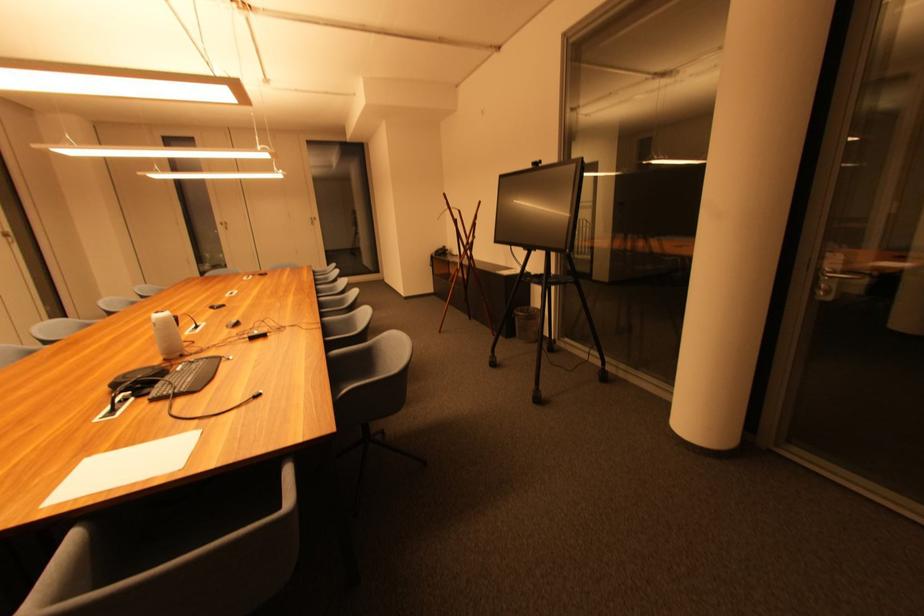
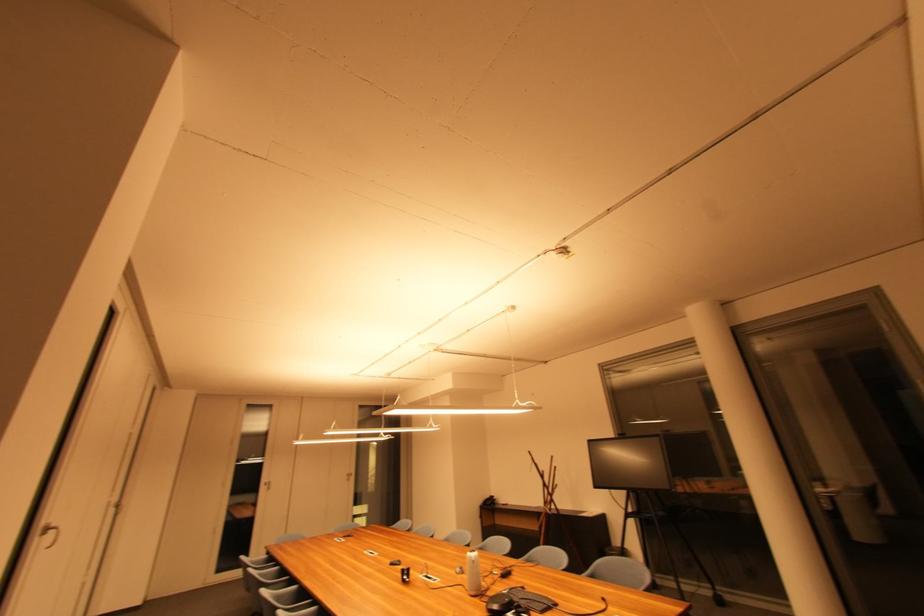
In the second image, find the point that corresponds to point 226,225 in the first image.

(271, 485)